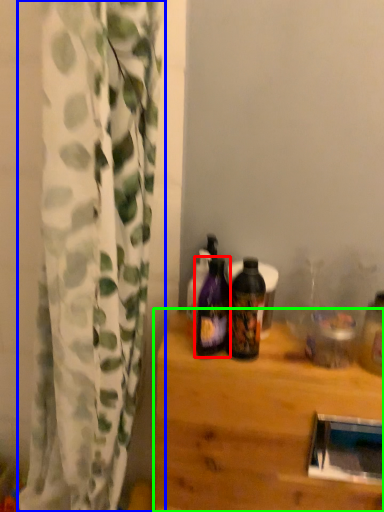
Question: Estimate the real-world distances between objects in this image. Which object is farther from bottle (highlighted by a red box), curtain (highlighted by a blue box) or table (highlighted by a green box)?

Choices:
 (A) curtain
 (B) table

Answer: (A)